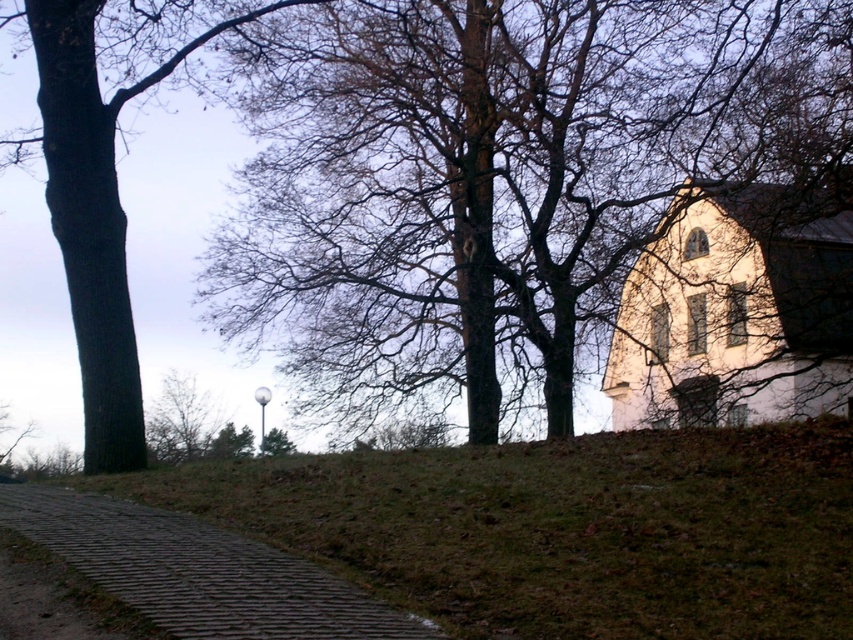
Who is lower down, brown rough tree at center or brown cobblestone path at lower left?

brown cobblestone path at lower left is lower down.

Consider the image. Is brown rough tree at center further to camera compared to brown cobblestone path at lower left?

Yes, brown rough tree at center is further from the viewer.

Does point (815, 88) come farther from viewer compared to point (74, 529)?

That is True.

Find the location of a particular element. The image size is (853, 640). brown rough tree at center is located at coordinates (498, 179).

How distant is brown rough tree at center from white matte church at upper right?

4.22 meters

Can you confirm if brown rough tree at center is wider than white matte church at upper right?

Correct, the width of brown rough tree at center exceeds that of white matte church at upper right.

Where is `brown rough tree at center`? The height and width of the screenshot is (640, 853). brown rough tree at center is located at coordinates (498, 179).

Consider the image. Which of these two, brown rough tree at center or dark brown bark tree at left, stands taller?

brown rough tree at center

Which is in front, point (405, 394) or point (51, 51)?

Point (51, 51)

Does point (683, 13) come in front of point (73, 8)?

That is False.

Find the location of a particular element. This screenshot has width=853, height=640. brown rough tree at center is located at coordinates [x=498, y=179].